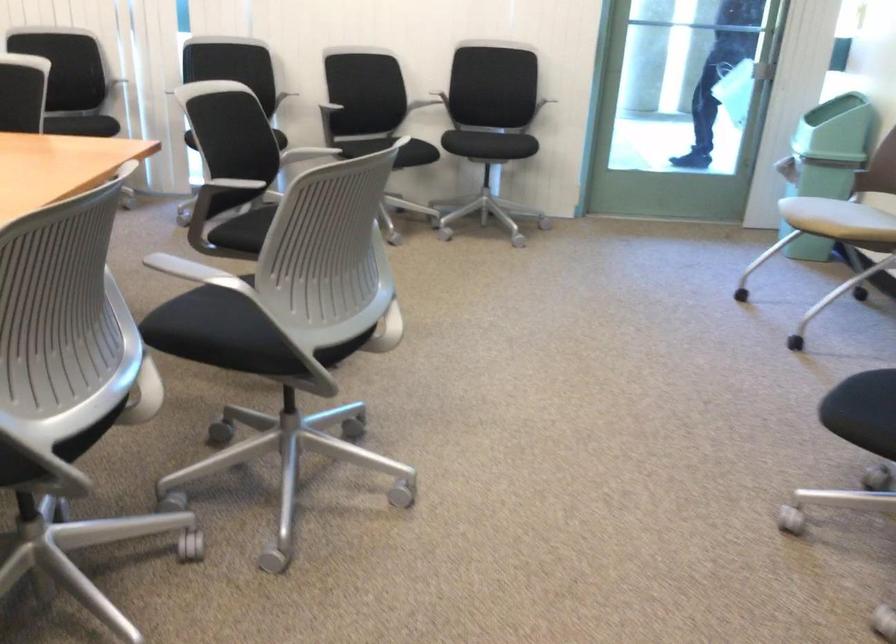
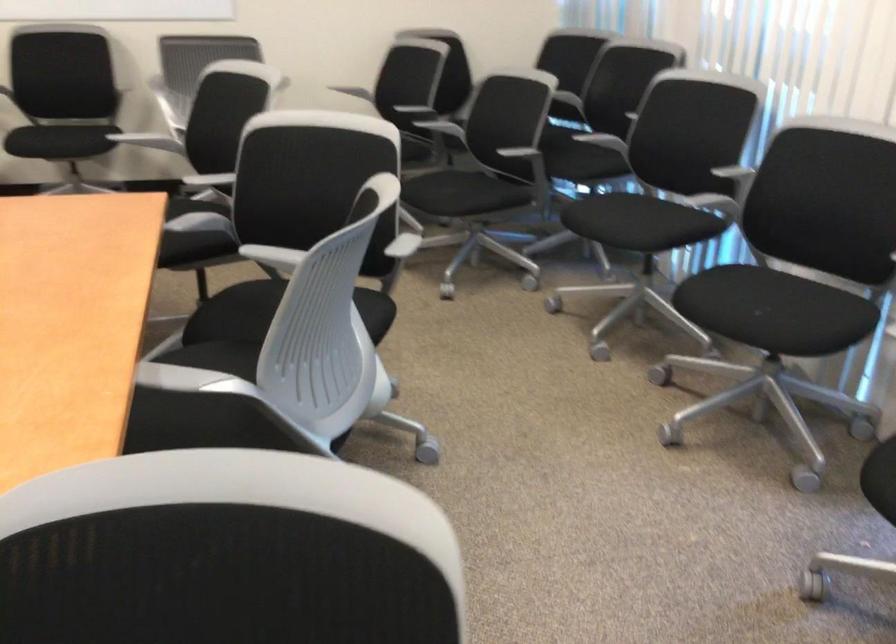
Find the pixel in the second image that matches point (90, 109) in the first image.

(771, 310)